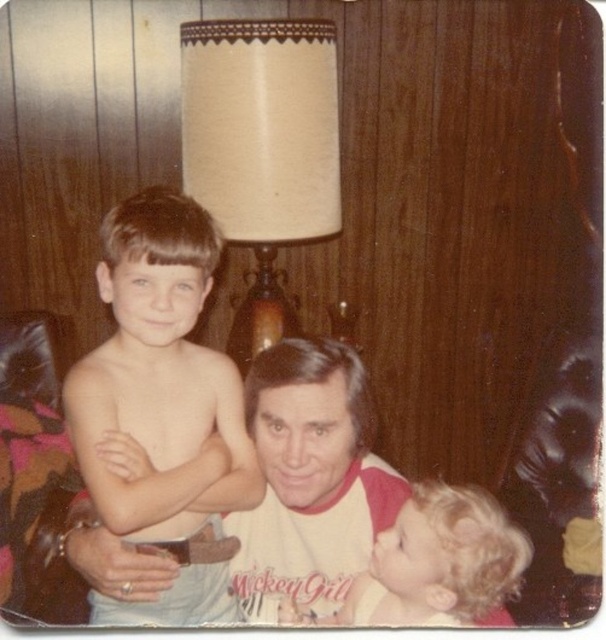
Question: Which of the following is the farthest from the observer?

Choices:
 (A) beige fabric lampshade at upper center
 (B) shiny blonde hair at center

Answer: (A)

Question: Which object is farther from the camera taking this photo?

Choices:
 (A) white/red raglan shirt at center
 (B) beige fabric lampshade at upper center
 (C) shiny blonde hair at center

Answer: (B)

Question: Can you confirm if beige fabric lampshade at upper center is positioned to the right of curly blonde hair at lower right?

Choices:
 (A) yes
 (B) no

Answer: (B)

Question: Based on their relative distances, which object is nearer to the beige fabric lampshade at upper center?

Choices:
 (A) curly blonde hair at lower right
 (B) shiny blonde hair at center
 (C) white/red raglan shirt at center

Answer: (B)

Question: Can you confirm if shiny blonde hair at center is positioned above white/red raglan shirt at center?

Choices:
 (A) no
 (B) yes

Answer: (B)

Question: Is the position of shiny blonde hair at center more distant than that of beige fabric lampshade at upper center?

Choices:
 (A) yes
 (B) no

Answer: (B)